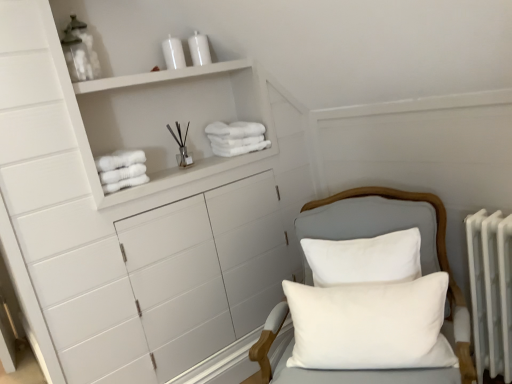
This screenshot has width=512, height=384. Describe the element at coordinates (421, 264) in the screenshot. I see `white fabric chair at center` at that location.

Find the location of a particular element. white fabric chair at center is located at coordinates (421, 264).

How much space does white soft towel at upper center, marked as the 2th bath towel in a bottom-to-top arrangement, occupy horizontally?

white soft towel at upper center, marked as the 2th bath towel in a bottom-to-top arrangement, is 12.80 inches wide.

In order to click on white matte cabinet at upper left in this screenshot , I will do `click(167, 120)`.

Describe the element at coordinates (364, 259) in the screenshot. Image resolution: width=512 pixels, height=384 pixels. I see `white soft pillow at center, placed as the 2th pillow when sorted from bottom to top` at that location.

I want to click on white fabric chair at center, so click(x=421, y=264).

Do you think white soft towel at upper center, the 2th bath towel from the left, is within white matte cabinet at upper left, or outside of it?

white soft towel at upper center, the 2th bath towel from the left, is located inside white matte cabinet at upper left.

Which object is positioned more to the left, white soft towel at upper center, placed as the 2th bath towel when sorted from front to back, or white matte cabinet at upper left?

Positioned to the left is white matte cabinet at upper left.

Are white soft towel at upper center, the 2th bath towel from the left, and white matte cabinet at upper left far apart?

No, white soft towel at upper center, the 2th bath towel from the left, is not far from white matte cabinet at upper left.

Is point (227, 151) positioned before point (106, 124)?

That is False.

From a real-world perspective, which is physically above, white fabric chair at center or white soft towel at upper center, placed as the 2th bath towel when sorted from front to back?

white soft towel at upper center, placed as the 2th bath towel when sorted from front to back, is physically above.

From the image's perspective, relative to white soft towel at upper center, the first bath towel from the back, is white fabric chair at center above or below?

white fabric chair at center is below white soft towel at upper center, the first bath towel from the back.

Is white fabric chair at center thinner than white soft towel at upper center, marked as the 2th bath towel in a bottom-to-top arrangement?

In fact, white fabric chair at center might be wider than white soft towel at upper center, marked as the 2th bath towel in a bottom-to-top arrangement.

Is white fabric chair at center taller than white soft towel at upper center, the 2th bath towel from the left?

Yes, white fabric chair at center is taller than white soft towel at upper center, the 2th bath towel from the left.

Is white matte cabinet at upper left located outside white fluffy towels at upper left, which is the first bath towel in front-to-back order?

Yes, white matte cabinet at upper left is outside of white fluffy towels at upper left, which is the first bath towel in front-to-back order.

From a real-world perspective, between white matte cabinet at upper left and white fluffy towels at upper left, marked as the first bath towel in a left-to-right arrangement, who is vertically lower?

white fluffy towels at upper left, marked as the first bath towel in a left-to-right arrangement, from a real-world perspective.

Considering the relative sizes of white matte cabinet at upper left and white fluffy towels at upper left, marked as the first bath towel in a left-to-right arrangement, in the image provided, is white matte cabinet at upper left bigger than white fluffy towels at upper left, marked as the first bath towel in a left-to-right arrangement,?

Correct, white matte cabinet at upper left is larger in size than white fluffy towels at upper left, marked as the first bath towel in a left-to-right arrangement.

Which of these two, white matte cabinet at upper left or white fluffy towels at upper left, marked as the first bath towel in a left-to-right arrangement, is thinner?

Thinner between the two is white fluffy towels at upper left, marked as the first bath towel in a left-to-right arrangement.

What's the angular difference between white soft pillow at center, which ranks as the first pillow in bottom-to-top order, and white fabric chair at center's facing directions?

The angle between the facing direction of white soft pillow at center, which ranks as the first pillow in bottom-to-top order, and the facing direction of white fabric chair at center is 4.23 degrees.

Is white fabric chair at center located within white soft pillow at center, which ranks as the first pillow in bottom-to-top order?

Actually, white fabric chair at center is outside white soft pillow at center, which ranks as the first pillow in bottom-to-top order.

Is white soft pillow at center, arranged as the second pillow when viewed from the top, positioned with its back to white fabric chair at center?

Yes, white fabric chair at center is at the back of white soft pillow at center, arranged as the second pillow when viewed from the top.

Which of these two, white soft pillow at center, arranged as the second pillow when viewed from the top, or white fabric chair at center, is smaller?

white soft pillow at center, arranged as the second pillow when viewed from the top, is smaller.

Is white matte cabinet at upper left at the left side of white soft pillow at center, marked as the first pillow in a top-to-bottom arrangement?

Indeed, white matte cabinet at upper left is positioned on the left side of white soft pillow at center, marked as the first pillow in a top-to-bottom arrangement.

Are white matte cabinet at upper left and white soft pillow at center, placed as the 2th pillow when sorted from bottom to top, making contact?

No, white matte cabinet at upper left is not in contact with white soft pillow at center, placed as the 2th pillow when sorted from bottom to top.

What's the angular difference between white matte cabinet at upper left and white soft pillow at center, placed as the 2th pillow when sorted from bottom to top,'s facing directions?

→ They differ by 57.4 degrees in their facing directions.

Between white fabric chair at center and white matte cabinet at upper left, which one is positioned behind?

white matte cabinet at upper left is further away from the camera.

From a real-world perspective, is white fabric chair at center above or below white matte cabinet at upper left?

Clearly, from a real-world perspective, white fabric chair at center is below white matte cabinet at upper left.

Is white fabric chair at center shorter than white matte cabinet at upper left?

No.

Which is more to the right, white soft pillow at center, placed as the 2th pillow when sorted from bottom to top, or white matte cabinet at upper left?

white soft pillow at center, placed as the 2th pillow when sorted from bottom to top, is more to the right.

From a real-world perspective, does white soft pillow at center, placed as the 2th pillow when sorted from bottom to top, stand above white matte cabinet at upper left?

No, from a real-world perspective, white soft pillow at center, placed as the 2th pillow when sorted from bottom to top, is not above white matte cabinet at upper left.

Which is closer, (318, 265) or (98, 94)?

The point (318, 265) is more forward.

Identify the location of the 1st bath towel below when counting from the white matte cabinet at upper left (from the image's perspective). This screenshot has height=384, width=512. tap(236, 137).

Locate an element on the screen. This screenshot has width=512, height=384. the 2nd bath towel above the white fabric chair at center (from a real-world perspective) is located at coordinates (236, 137).

Considering their positions, is white soft towel at upper center, marked as the 2th bath towel in a bottom-to-top arrangement, positioned further to white soft pillow at center, which ranks as the first pillow in bottom-to-top order, than white matte cabinet at upper left?

white matte cabinet at upper left is further to white soft pillow at center, which ranks as the first pillow in bottom-to-top order.

Looking at this image, looking at the image, which one is located closer to white matte cabinet at upper left, white fabric chair at center or white fluffy towels at upper left, which is the first bath towel in front-to-back order?

white fluffy towels at upper left, which is the first bath towel in front-to-back order.

Estimate the real-world distances between objects in this image. Which object is closer to white fluffy towels at upper left, which is the first bath towel in front-to-back order, white soft pillow at center, placed as the 2th pillow when sorted from bottom to top, or white fabric chair at center?

The object closer to white fluffy towels at upper left, which is the first bath towel in front-to-back order, is white soft pillow at center, placed as the 2th pillow when sorted from bottom to top.

In the scene shown: When comparing their distances from white fabric chair at center, does white matte cabinet at upper left or white fluffy towels at upper left, marked as the first bath towel in a left-to-right arrangement, seem further?

white fluffy towels at upper left, marked as the first bath towel in a left-to-right arrangement, is positioned further to the anchor white fabric chair at center.

From the image, which object appears to be farther from white soft towel at upper center, the 2th bath towel from the left, white matte cabinet at upper left or white soft pillow at center, arranged as the second pillow when viewed from the top?

white soft pillow at center, arranged as the second pillow when viewed from the top, is positioned further to the anchor white soft towel at upper center, the 2th bath towel from the left.

Based on their spatial positions, is white matte cabinet at upper left or white fabric chair at center closer to white fluffy towels at upper left, which is the second bath towel in back-to-front order?

white matte cabinet at upper left is positioned closer to the anchor white fluffy towels at upper left, which is the second bath towel in back-to-front order.

Estimate the real-world distances between objects in this image. Which object is closer to white fluffy towels at upper left, which is the second bath towel in back-to-front order, white soft pillow at center, marked as the first pillow in a top-to-bottom arrangement, or white soft pillow at center, which ranks as the first pillow in bottom-to-top order?

white soft pillow at center, marked as the first pillow in a top-to-bottom arrangement, is positioned closer to the anchor white fluffy towels at upper left, which is the second bath towel in back-to-front order.

Considering their positions, is white matte cabinet at upper left positioned further to white fabric chair at center than white soft pillow at center, placed as the 2th pillow when sorted from bottom to top?

Among the two, white matte cabinet at upper left is located further to white fabric chair at center.

Find the location of a particular element. bath towel between white matte cabinet at upper left and white soft pillow at center, placed as the 2th pillow when sorted from bottom to top is located at coordinates (236, 137).

This screenshot has height=384, width=512. Find the location of `pillow between white soft pillow at center, which ranks as the first pillow in bottom-to-top order, and white soft towel at upper center, the 1th bath towel viewed from the top, along the z-axis`. pillow between white soft pillow at center, which ranks as the first pillow in bottom-to-top order, and white soft towel at upper center, the 1th bath towel viewed from the top, along the z-axis is located at coordinates (364, 259).

Image resolution: width=512 pixels, height=384 pixels. What are the coordinates of `cabinet situated between white fluffy towels at upper left, the first bath towel in the bottom-to-top sequence, and white soft pillow at center, which ranks as the first pillow in bottom-to-top order, from left to right` in the screenshot? It's located at (167, 120).

Identify the location of bath towel between white fluffy towels at upper left, which is the second bath towel in back-to-front order, and white soft pillow at center, placed as the 2th pillow when sorted from bottom to top, in the horizontal direction. The image size is (512, 384). (236, 137).